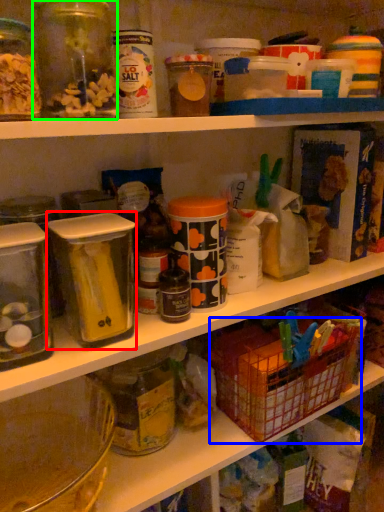
Question: Based on their relative distances, which object is nearer to carton (highlighted by a red box)? Choose from basket (highlighted by a blue box) and glass jar (highlighted by a green box).

Choices:
 (A) basket
 (B) glass jar

Answer: (B)